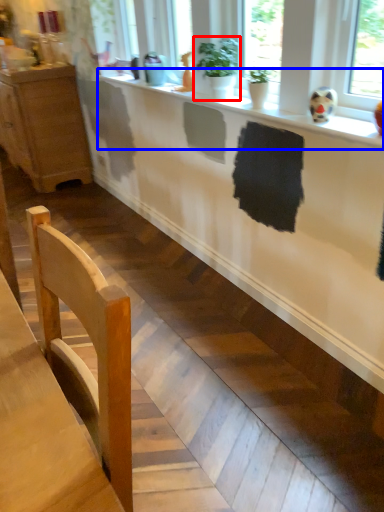
Question: Among these objects, which one is farthest to the camera, houseplant (highlighted by a red box) or counter top (highlighted by a blue box)?

Choices:
 (A) houseplant
 (B) counter top

Answer: (A)